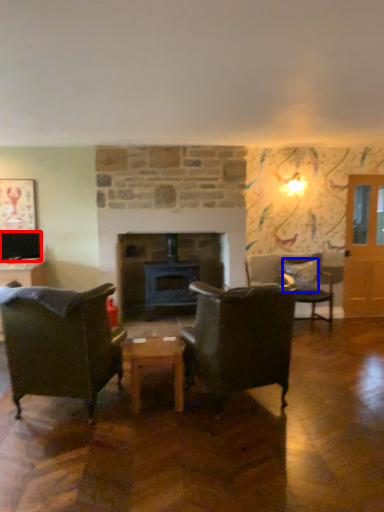
Question: Among these objects, which one is nearest to the camera, television (highlighted by a red box) or pillow (highlighted by a blue box)?

Choices:
 (A) television
 (B) pillow

Answer: (A)